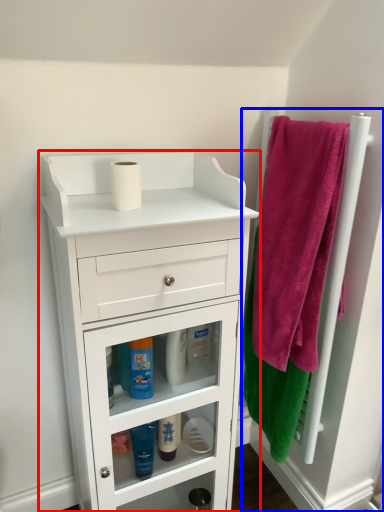
Question: Which of the following is the closest to the observer, chest of drawers (highlighted by a red box) or door (highlighted by a blue box)?

Choices:
 (A) chest of drawers
 (B) door

Answer: (A)